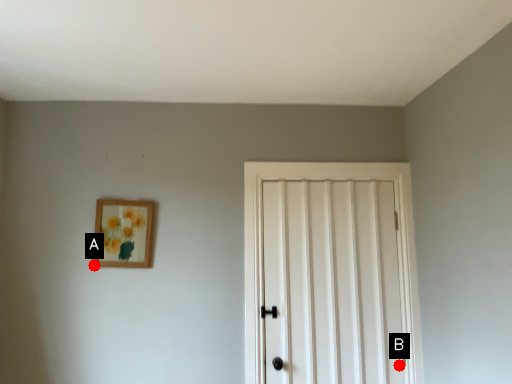
Question: Two points are circled on the image, labeled by A and B beside each circle. Among these points, which one is nearest to the camera?

Choices:
 (A) A is closer
 (B) B is closer

Answer: (A)